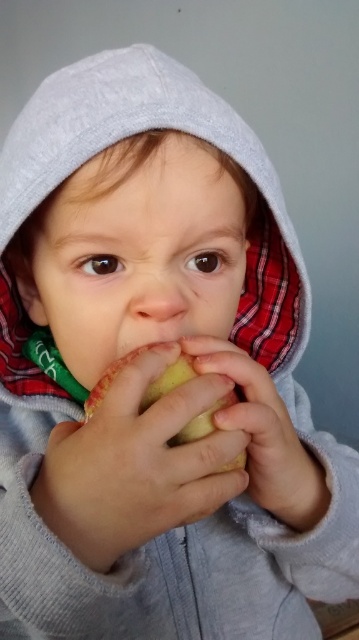
Which is in front, point (263, 260) or point (145, 397)?

Point (145, 397) is in front.

Can you confirm if gray cotton hoodie at center is positioned to the right of yellow matte apple at center?

Yes, gray cotton hoodie at center is to the right of yellow matte apple at center.

At what (x,y) coordinates should I click in order to perform the action: click on gray cotton hoodie at center. Please return your answer as a coordinate pair (x, y). Looking at the image, I should click on (132, 132).

The height and width of the screenshot is (640, 359). I want to click on gray cotton hoodie at center, so click(x=132, y=132).